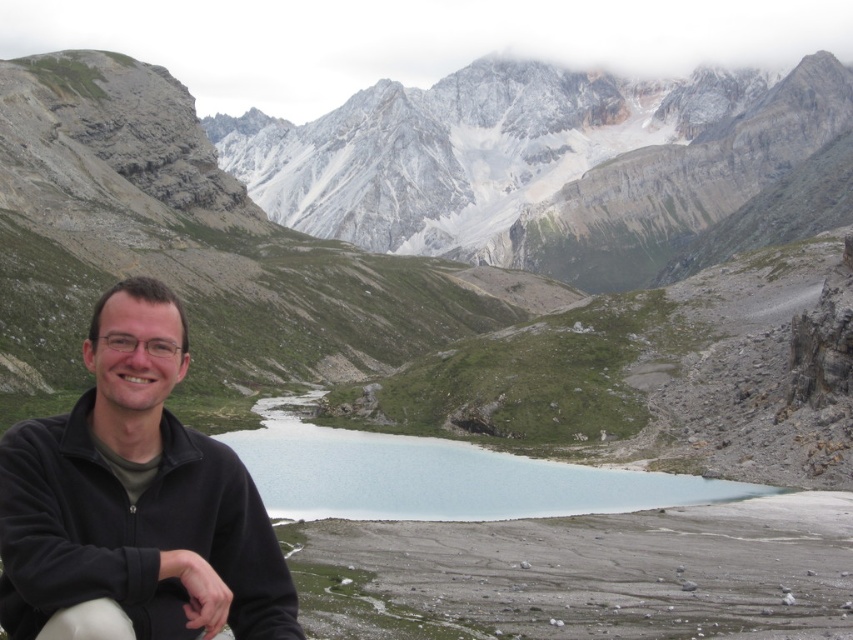
Is black fleece jacket at lower left bigger than clear blue water at center?

Incorrect, black fleece jacket at lower left is not larger than clear blue water at center.

Can you confirm if black fleece jacket at lower left is positioned to the right of clear blue water at center?

No, black fleece jacket at lower left is not to the right of clear blue water at center.

Is point (113, 621) positioned in front of point (670, 502)?

That is True.

Image resolution: width=853 pixels, height=640 pixels. In order to click on black fleece jacket at lower left in this screenshot , I will do `click(134, 502)`.

Find the location of a particular element. The height and width of the screenshot is (640, 853). gray rocky mountain at upper center is located at coordinates (561, 168).

Does gray rocky mountain at upper center have a greater height compared to clear blue water at center?

Indeed, gray rocky mountain at upper center has a greater height compared to clear blue water at center.

Identify the location of gray rocky mountain at upper center. (561, 168).

Is matte gray rock at center positioned at the back of clear blue water at center?

Yes, matte gray rock at center is behind clear blue water at center.

Is matte gray rock at center bigger than clear blue water at center?

Correct, matte gray rock at center is larger in size than clear blue water at center.

Is point (90, 196) in front of point (621, 476)?

No, it is not.

I want to click on matte gray rock at center, so pyautogui.click(x=457, y=262).